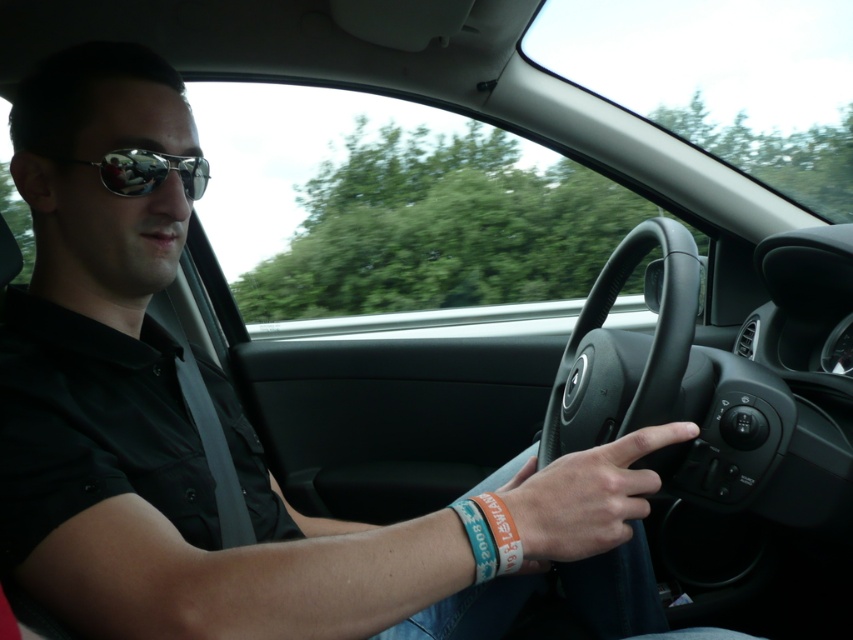
Based on the photo, you are a passenger in a car and want to reach a point marked at coordinate point (585,417). If your arm can extend 1 meter, can you reach it?

The distance between point (585,417) and the camera is 1.07 meters. Since your arm can only extend 1 meter, you cannot reach it.

You are a delivery robot with a height of 33 inches. You need to deliver a package to the car shown in the image. Can you fit through the space between the camera and the point at [654,429] without bending?

The distance between the camera and the point at [654,429] is 33.53 inches. Since the robot is 33 inches tall, it can fit through the space without bending.